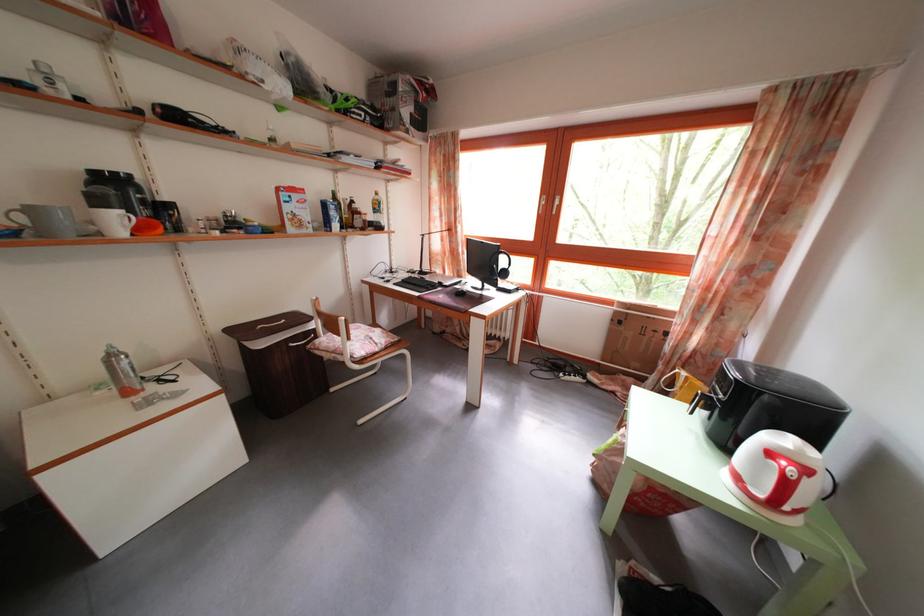
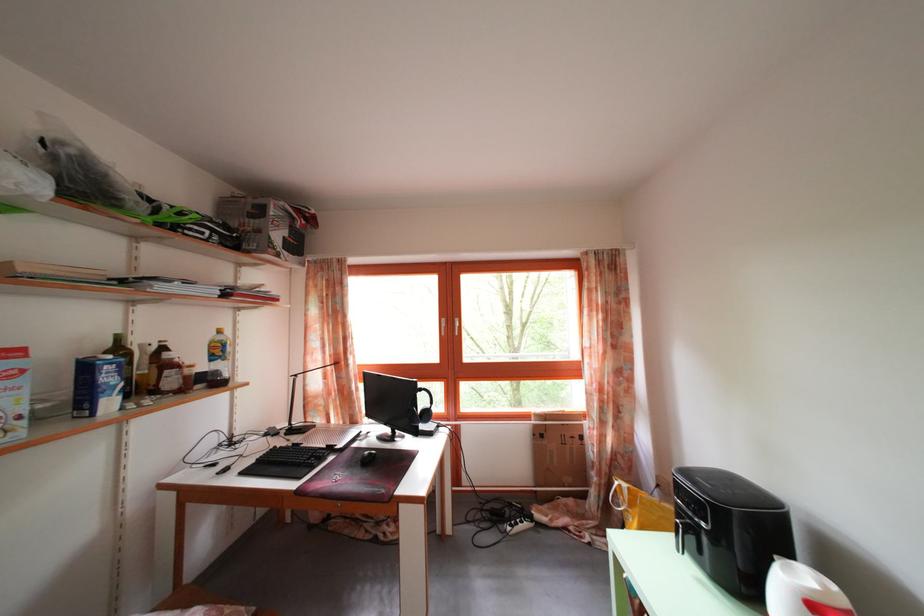
The point at (508, 260) is marked in the first image. Where is the corresponding point in the second image?

(428, 397)